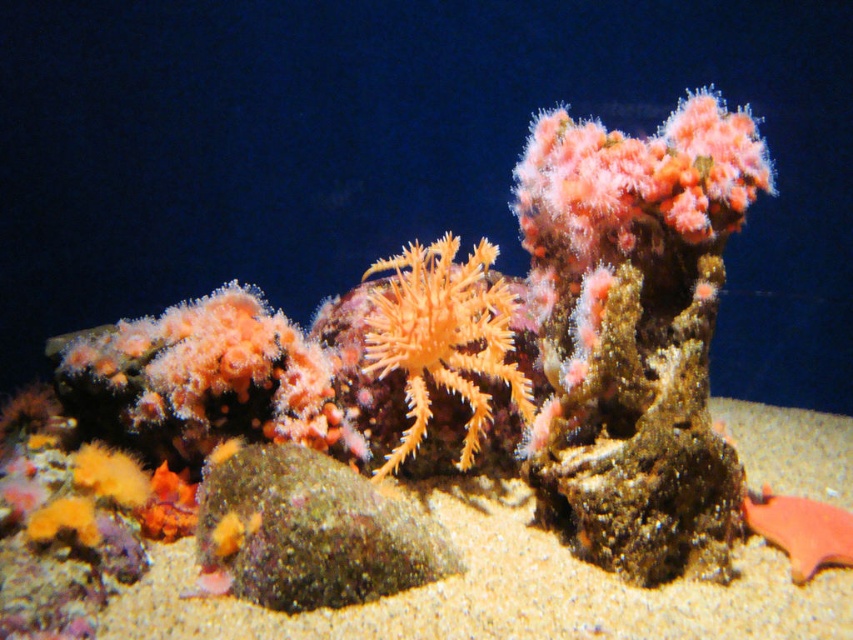
You are an underwater explorer trying to place a small anchor. You see the sandy textured sand at center and the orange soft coral at center. Which area would you choose to anchor if you need a larger surface area?

The sandy textured sand at center is bigger than the orange soft coral at center, so you should choose the sandy textured sand at center for anchoring as it provides a larger surface area.

You are a small fish swimming in the underwater scene. You need to find a place to hide between the sandy textured sand at center and the orange soft coral at center. Which one is wider and can provide more coverage?

The sandy textured sand at center might be wider than orange soft coral at center, so it can provide more coverage for hiding.

You are a marine biologist examining the underwater scene. You notice the sandy textured sand at center and the smooth orange fish at lower right. Which object is taller in this environment?

The sandy textured sand at center has a greater height compared to the smooth orange fish at lower right.